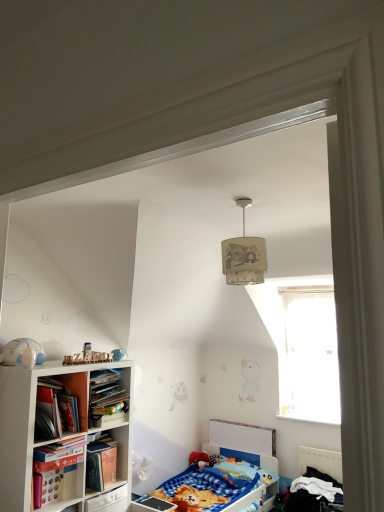
You are a GUI agent. You are given a task and a screenshot of the screen. Output one action in this format:
    pyautogui.click(x=<x>, y=<y>)
    Task: Click on the blank space situated above beige fabric lampshade at upper center (from a real-world perspective)
    The width and height of the screenshot is (384, 512).
    Given the screenshot: What is the action you would take?
    pyautogui.click(x=237, y=200)